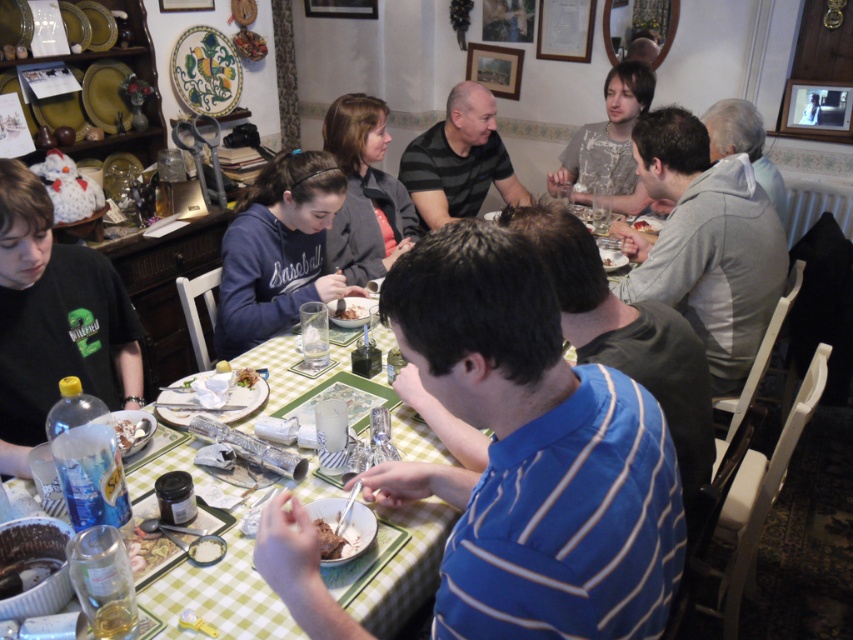
Question: Does gray fleece jacket at upper right lie in front of smooth white bowl at center?

Choices:
 (A) no
 (B) yes

Answer: (A)

Question: Which object appears closest to the camera in this image?

Choices:
 (A) white matte bread at center
 (B) golden brown bread at center
 (C) smooth chocolate cake at center
 (D) smooth white bowl at center

Answer: (D)

Question: Estimate the real-world distances between objects in this image. Which object is closer to the golden brown bread at center?

Choices:
 (A) smooth chocolate cake at center
 (B) brown crumbly cake at lower center
 (C) black striped shirt at center
 (D) matte brown bowl at center

Answer: (D)

Question: Is green checkered tablecloth at center to the right of matte brown bowl at center from the viewer's perspective?

Choices:
 (A) no
 (B) yes

Answer: (A)

Question: Which point is closer to the camera?

Choices:
 (A) (125, 435)
 (B) (363, 312)
 (C) (668, 246)
 (D) (468, 125)

Answer: (A)

Question: Is brown crumbly cake at lower center below golden brown bread at center?

Choices:
 (A) yes
 (B) no

Answer: (A)